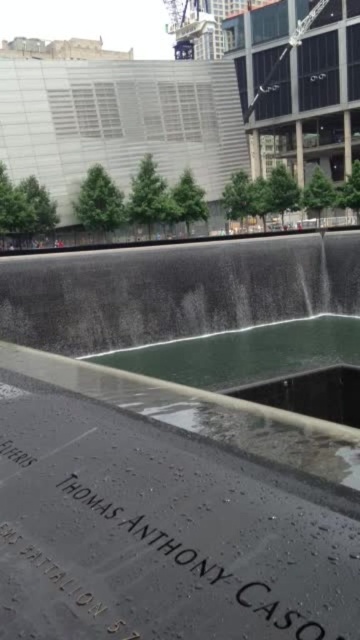
Question: Does green polished stone fountain at center have a greater width compared to black polished stone at center?

Choices:
 (A) yes
 (B) no

Answer: (A)

Question: Does green polished stone fountain at center appear on the right side of black polished stone at center?

Choices:
 (A) no
 (B) yes

Answer: (A)

Question: Does green polished stone fountain at center have a larger size compared to black polished stone at center?

Choices:
 (A) yes
 (B) no

Answer: (A)